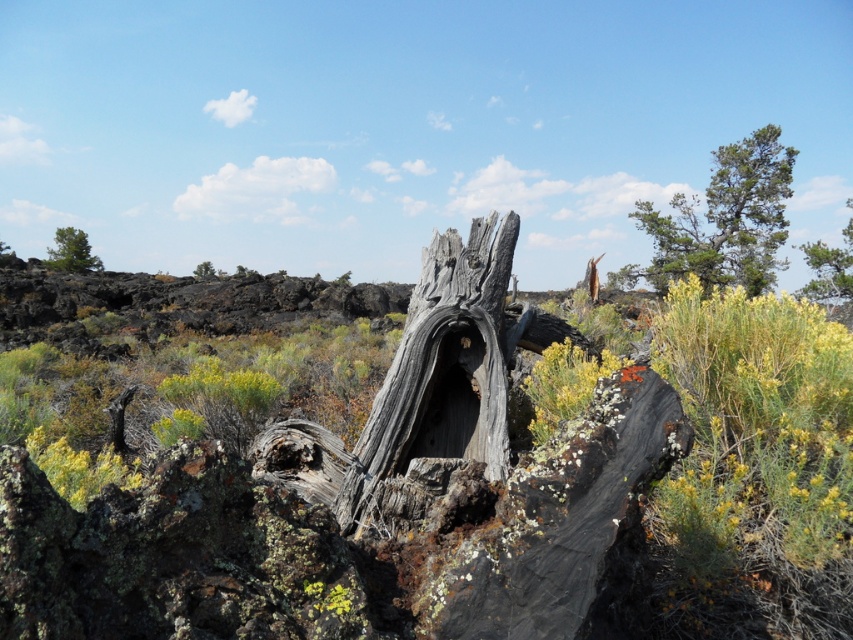
Does green rough bark tree at upper left have a lesser width compared to gray rough bark tree at upper center?

Yes.

Is green rough bark tree at upper left positioned behind gray rough bark tree at upper center?

That is True.

Is point (61, 262) positioned before point (200, 268)?

Yes, it is in front of point (200, 268).

Image resolution: width=853 pixels, height=640 pixels. Find the location of `green rough bark tree at upper left`. green rough bark tree at upper left is located at coordinates (73, 252).

Which is behind, point (752, 202) or point (206, 273)?

The point (206, 273) is behind.

Is green rough bark tree at upper right further to the viewer compared to gray rough bark tree at upper center?

No, it is not.

Does point (770, 227) come behind point (198, 264)?

That is False.

Identify the location of green rough bark tree at upper right. This screenshot has height=640, width=853. (726, 218).

Between green rough bark tree at upper left and yellow lichen at center, which one is positioned higher?

green rough bark tree at upper left is above.

Can you confirm if green rough bark tree at upper left is bigger than yellow lichen at center?

Indeed, green rough bark tree at upper left has a larger size compared to yellow lichen at center.

Is point (70, 243) behind point (340, 616)?

That is True.

Image resolution: width=853 pixels, height=640 pixels. I want to click on green rough bark tree at upper left, so click(x=73, y=252).